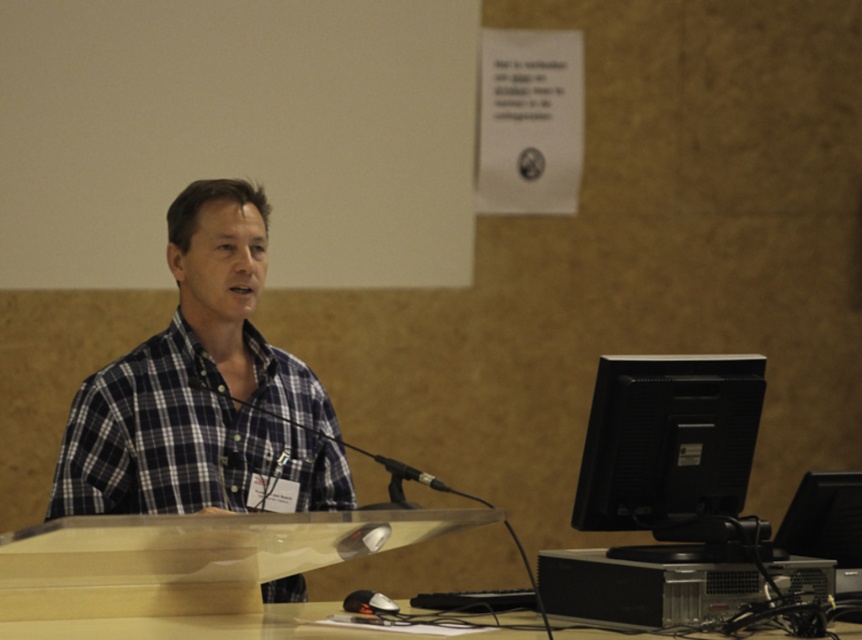
You are standing at the speaker podium and need to reach both the microphone and the remote control. Which object is closer to you, the point at (167, 344) or the point at (589, 636)?

The point at (167, 344) is closer to you because it is behind the point at (589, 636).

You are organizing a small event and need to ensure that the plaid cotton shirt at center and the clear plastic table at center can fit side by side on a 1.5 meter wide stage. Based on their widths, will they fit together?

The plaid cotton shirt at center has a lesser width compared to clear plastic table at center. Assuming the total width of both items combined is less than 1.5 meters, they should fit together on the stage.